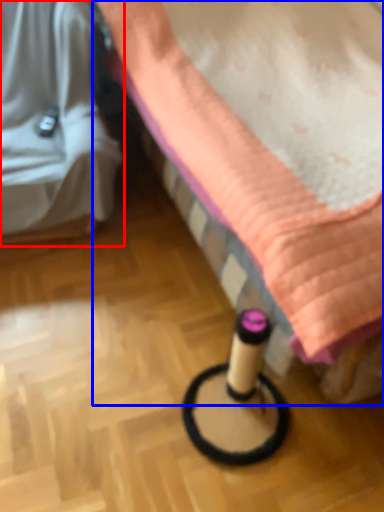
Question: Which object appears closest to the camera in this image, furniture (highlighted by a red box) or furniture (highlighted by a blue box)?

Choices:
 (A) furniture
 (B) furniture

Answer: (B)